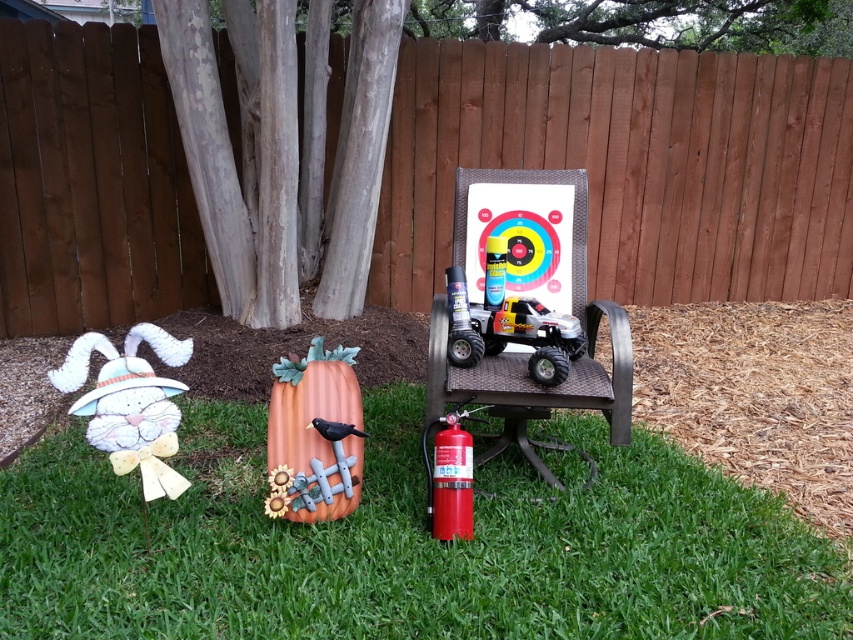
Between point (343, 452) and point (96, 348), which one is positioned in front?

Point (96, 348) is in front.

Can you confirm if orange matte pumpkin at lower left is positioned to the right of white fabric bunny at left?

Yes, orange matte pumpkin at lower left is to the right of white fabric bunny at left.

At what (x,y) coordinates should I click in order to perform the action: click on orange matte pumpkin at lower left. Please return your answer as a coordinate pair (x, y). Image resolution: width=853 pixels, height=640 pixels. Looking at the image, I should click on (312, 436).

The image size is (853, 640). What are the coordinates of `orange matte pumpkin at lower left` in the screenshot? It's located at click(x=312, y=436).

Does green grass at lower left have a greater width compared to red matte fire extinguisher at center?

Indeed, green grass at lower left has a greater width compared to red matte fire extinguisher at center.

Which is in front, point (376, 544) or point (457, 508)?

Point (376, 544) is more forward.

You are a GUI agent. You are given a task and a screenshot of the screen. Output one action in this format:
    pyautogui.click(x=<x>, y=<y>)
    Task: Click on the green grass at lower left
    This screenshot has height=640, width=853.
    Given the screenshot: What is the action you would take?
    pyautogui.click(x=407, y=545)

Can you confirm if brown wood fence at upper center is taller than metallic plastic wagon at center?

Yes, brown wood fence at upper center is taller than metallic plastic wagon at center.

Can you confirm if brown wood fence at upper center is positioned to the right of metallic plastic wagon at center?

Correct, you'll find brown wood fence at upper center to the right of metallic plastic wagon at center.

Is point (73, 196) positioned after point (437, 332)?

Yes, it is.

Where is `brown wood fence at upper center`? Image resolution: width=853 pixels, height=640 pixels. brown wood fence at upper center is located at coordinates (631, 164).